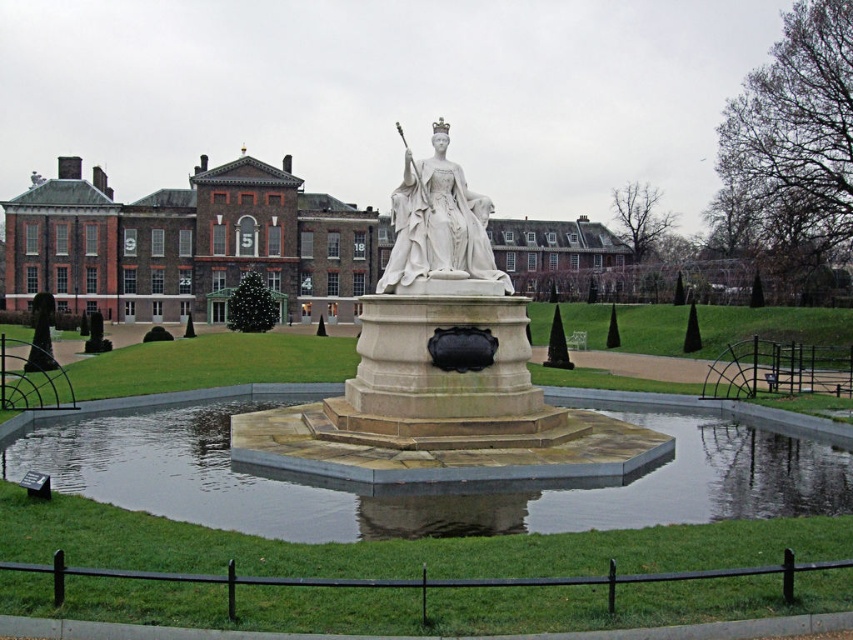
Question: Which point appears closest to the camera in this image?

Choices:
 (A) (469, 442)
 (B) (486, 208)
 (C) (842, 532)

Answer: (C)

Question: Which object is closer to the camera taking this photo?

Choices:
 (A) smooth stone pond at center
 (B) white stone fountain at center
 (C) white marble statue at center

Answer: (B)

Question: Does white stone fountain at center come behind white marble fountain at center?

Choices:
 (A) yes
 (B) no

Answer: (B)

Question: Where is smooth stone pond at center located in relation to white marble statue at center in the image?

Choices:
 (A) right
 (B) left

Answer: (A)

Question: Is white marble fountain at center wider than brown brick palace at center?

Choices:
 (A) yes
 (B) no

Answer: (B)

Question: Which object is farther from the camera taking this photo?

Choices:
 (A) white stone fountain at center
 (B) white marble fountain at center
 (C) white marble statue at center

Answer: (C)